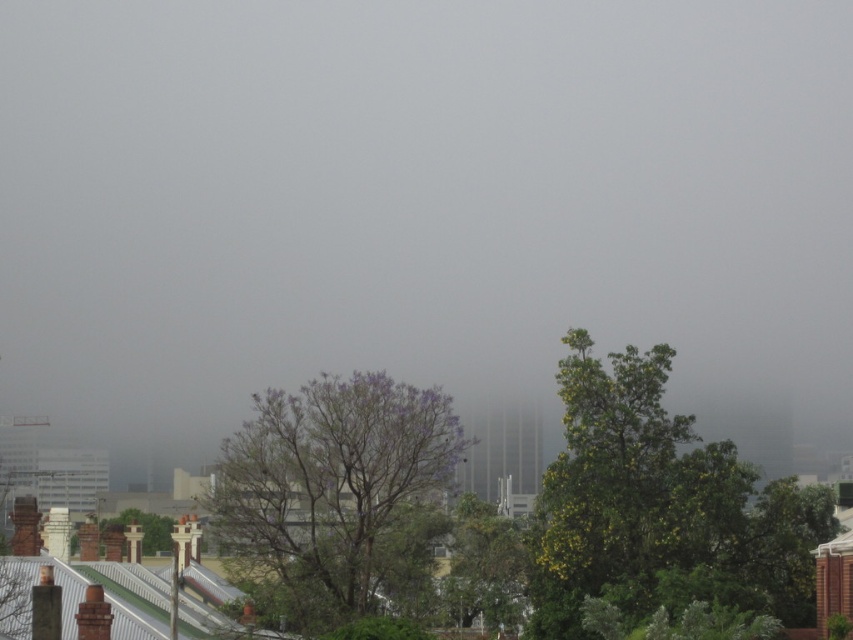
Question: Can you confirm if green leafy tree at right is positioned below brown textured chimney at lower left?

Choices:
 (A) yes
 (B) no

Answer: (B)

Question: Is purple leafy tree at center wider than brown textured chimney at lower left?

Choices:
 (A) no
 (B) yes

Answer: (B)

Question: Among these points, which one is nearest to the camera?

Choices:
 (A) (170, 524)
 (B) (724, 552)

Answer: (B)

Question: Which point is farther to the camera?

Choices:
 (A) (686, 490)
 (B) (146, 548)

Answer: (B)

Question: Which object appears farthest from the camera in this image?

Choices:
 (A) purple leafy tree at center
 (B) green leafy tree at right

Answer: (B)

Question: Observing the image, what is the correct spatial positioning of green leafy tree at right in reference to purple leafy tree at center?

Choices:
 (A) below
 (B) above

Answer: (A)